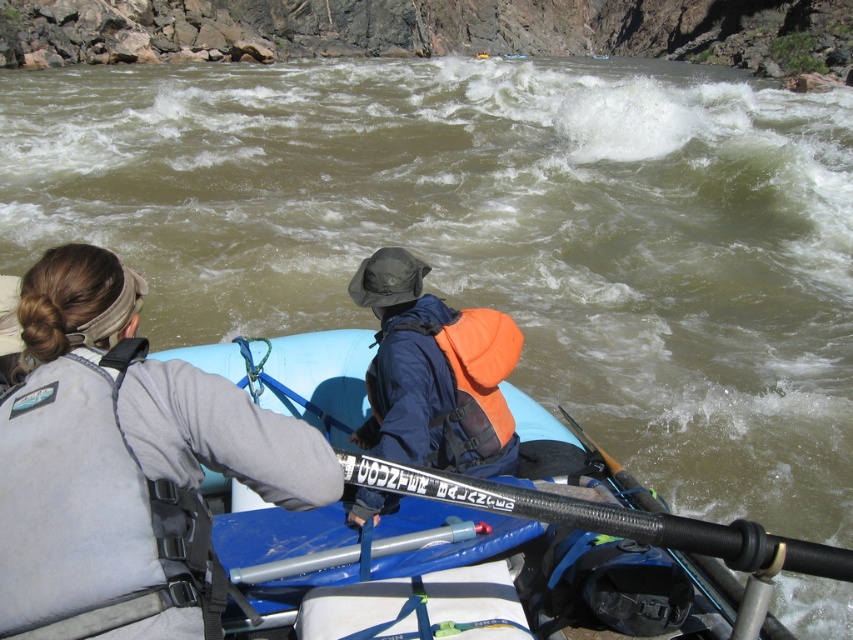
Can you confirm if blue rubber boat at center is shorter than orange fleece life jacket at center?

Yes, blue rubber boat at center is shorter than orange fleece life jacket at center.

Between blue rubber boat at center and orange fleece life jacket at center, which one has less height?

blue rubber boat at center is shorter.

Is point (257, 500) more distant than point (403, 337)?

No, (257, 500) is in front of (403, 337).

This screenshot has width=853, height=640. Identify the location of blue rubber boat at center. (296, 374).

Between blue rubber boat at center and black textured paddle at center, which one is positioned higher?

blue rubber boat at center

Describe the element at coordinates (296, 374) in the screenshot. The height and width of the screenshot is (640, 853). I see `blue rubber boat at center` at that location.

Is point (660, 506) positioned behind point (485, 488)?

That is True.

Where is `blue rubber boat at center`? blue rubber boat at center is located at coordinates (296, 374).

Does gray fabric life vest at left appear on the right side of orange fleece life jacket at center?

No, gray fabric life vest at left is not to the right of orange fleece life jacket at center.

Which is in front, point (177, 538) or point (469, 404)?

Positioned in front is point (177, 538).

Between point (144, 518) and point (456, 442), which one is positioned behind?

Point (456, 442)

Locate an element on the screen. gray fabric life vest at left is located at coordinates (125, 460).